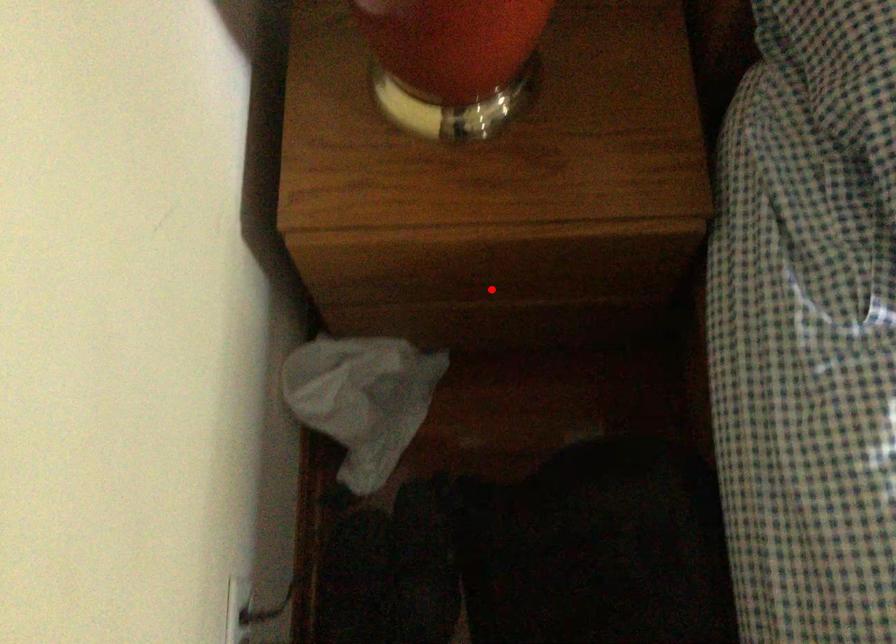
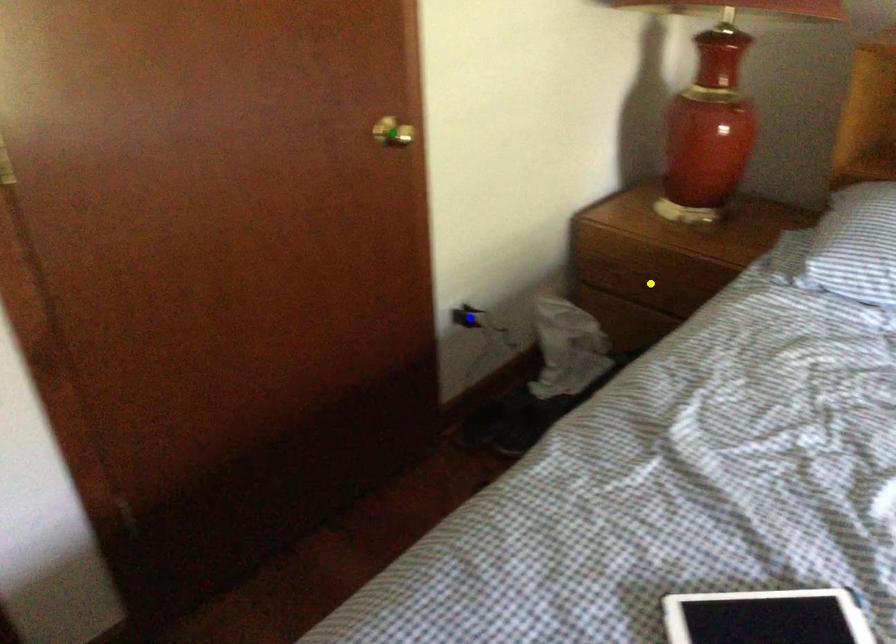
Question: I am providing you with two images of the same scene from different viewpoints. A red point is marked on the first image. You are given multiple points on the second image. Can you choose the point in image 2 that corresponds to the point in image 1?

Choices:
 (A) blue point
 (B) green point
 (C) yellow point

Answer: (C)